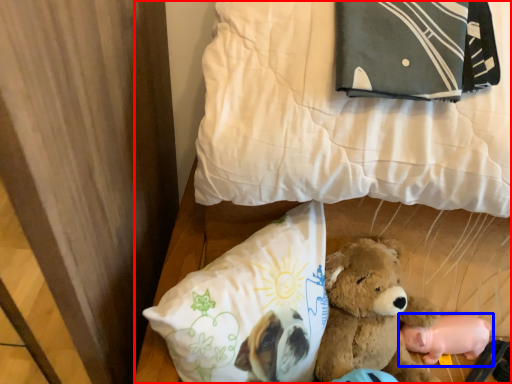
Question: Among these objects, which one is farthest to the camera, bed (highlighted by a red box) or toy (highlighted by a blue box)?

Choices:
 (A) bed
 (B) toy

Answer: (B)